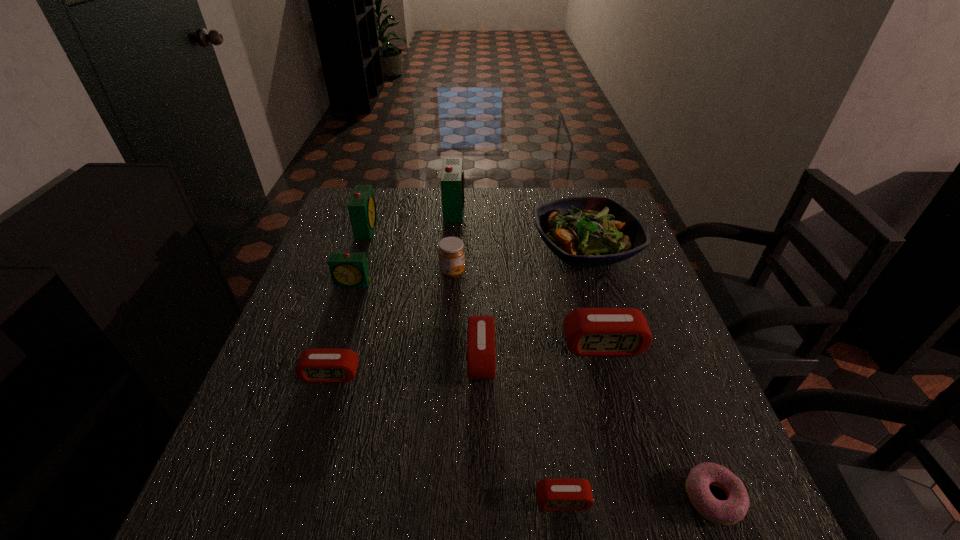
In the image, there is a desktop. Where is `vacant space at the right edge`? The image size is (960, 540). vacant space at the right edge is located at coordinates (658, 334).

Where is `vacant space at the near left corner of the desktop`? vacant space at the near left corner of the desktop is located at coordinates (286, 518).

Locate an element on the screen. This screenshot has width=960, height=540. free spot between the blue salad plate and the second shortest alarm clock is located at coordinates (458, 312).

Find the location of a particular element. This screenshot has height=540, width=960. free point between the rightmost pink alarm clock and the smallest pink alarm clock is located at coordinates click(x=583, y=423).

I want to click on free spot between the salad plate and the shortest alarm clock, so pyautogui.click(x=574, y=375).

Identify the location of vacant area that lies between the third farthest alarm clock and the blue salad plate. This screenshot has width=960, height=540. (469, 266).

Locate an element on the screen. free area in between the orange jam and the doughnut is located at coordinates (583, 385).

At what (x,y) coordinates should I click in order to perform the action: click on unoccupied area between the second shortest object and the second biggest green alarm clock. Please return your answer as a coordinate pair (x, y). Looking at the image, I should click on (465, 364).

This screenshot has width=960, height=540. In order to click on empty space between the second shortest alarm clock and the pink doughnut in this screenshot , I will do `click(522, 436)`.

Where is `free space between the doughnut and the fourth shortest object`? free space between the doughnut and the fourth shortest object is located at coordinates (597, 427).